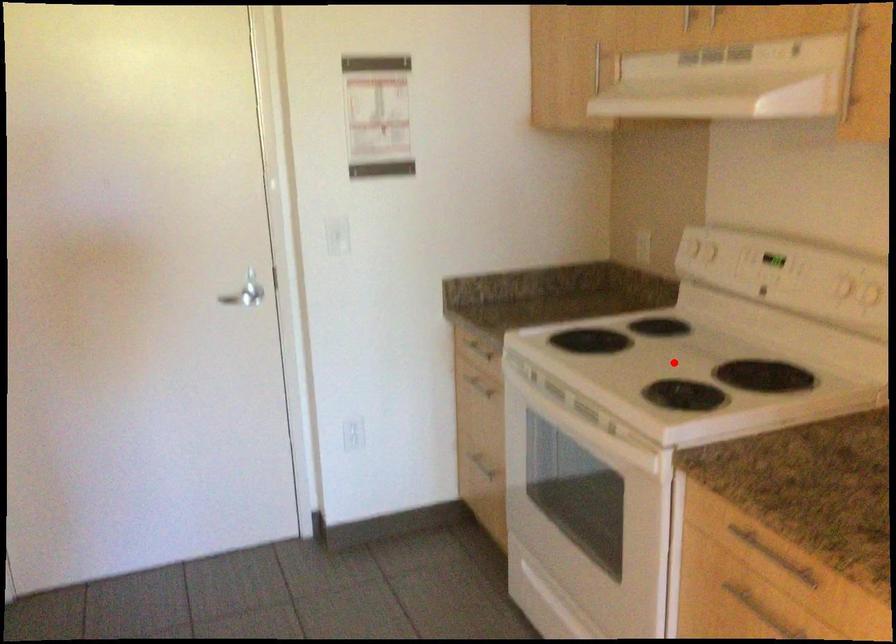
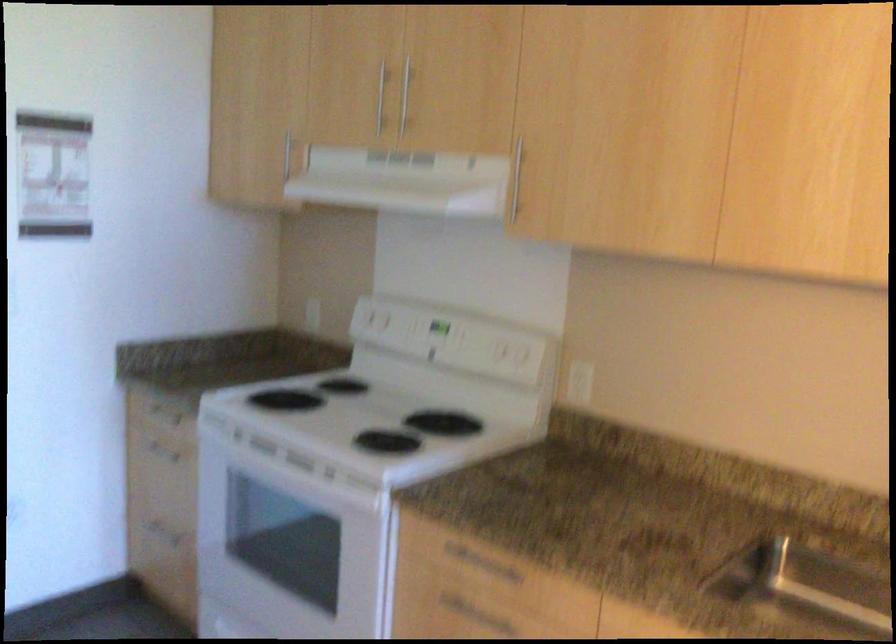
Question: I am providing you with two images of the same scene from different viewpoints. A red point is shown in image1. For the corresponding object point in image2, is it positioned nearer or farther from the camera?

Choices:
 (A) Nearer
 (B) Farther

Answer: (B)